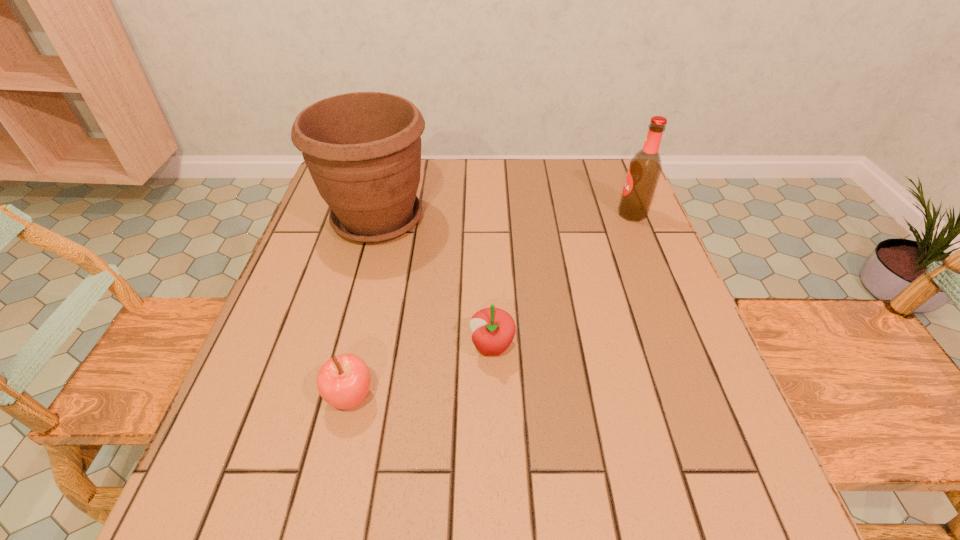
Where is `vacant space at the far right corner of the desktop`? This screenshot has width=960, height=540. vacant space at the far right corner of the desktop is located at coordinates (602, 160).

At what (x,y) coordinates should I click in order to perform the action: click on empty space between the flowerpot and the beer bottle. Please return your answer as a coordinate pair (x, y). Looking at the image, I should click on (505, 217).

What are the coordinates of `free space between the flowerpot and the rightmost object` in the screenshot? It's located at (505, 217).

Identify the location of empty space that is in between the right apple and the flowerpot. (435, 283).

You are a GUI agent. You are given a task and a screenshot of the screen. Output one action in this format:
    pyautogui.click(x=<x>, y=<y>)
    Task: Click on the free point between the beer bottle and the right apple
    
    Given the screenshot: What is the action you would take?
    pyautogui.click(x=562, y=280)

At what (x,y) coordinates should I click in order to perform the action: click on empty space that is in between the rightmost object and the second nearest object. Please return your answer as a coordinate pair (x, y). This screenshot has height=540, width=960. Looking at the image, I should click on (562, 280).

You are a GUI agent. You are given a task and a screenshot of the screen. Output one action in this format:
    pyautogui.click(x=<x>, y=<y>)
    Task: Click on the empty location between the flowerpot and the nearest object
    The width and height of the screenshot is (960, 540).
    Given the screenshot: What is the action you would take?
    pyautogui.click(x=364, y=308)

Where is `unoccupied area between the rightmost object and the flowerpot`? unoccupied area between the rightmost object and the flowerpot is located at coordinates (505, 217).

Identify the location of vacant region between the flowerpot and the third object from left to right. This screenshot has height=540, width=960. (435, 283).

I want to click on vacant point located between the nearer apple and the flowerpot, so click(364, 308).